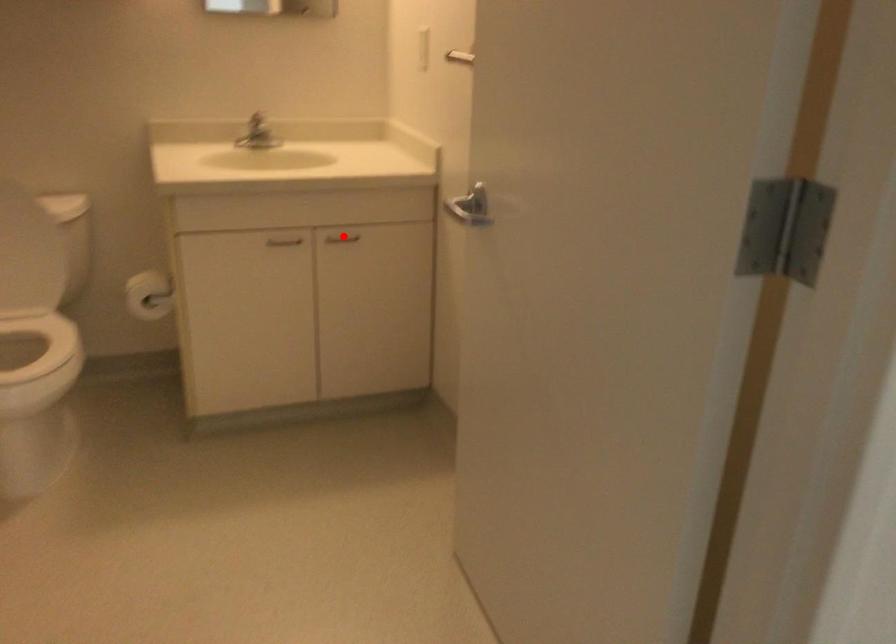
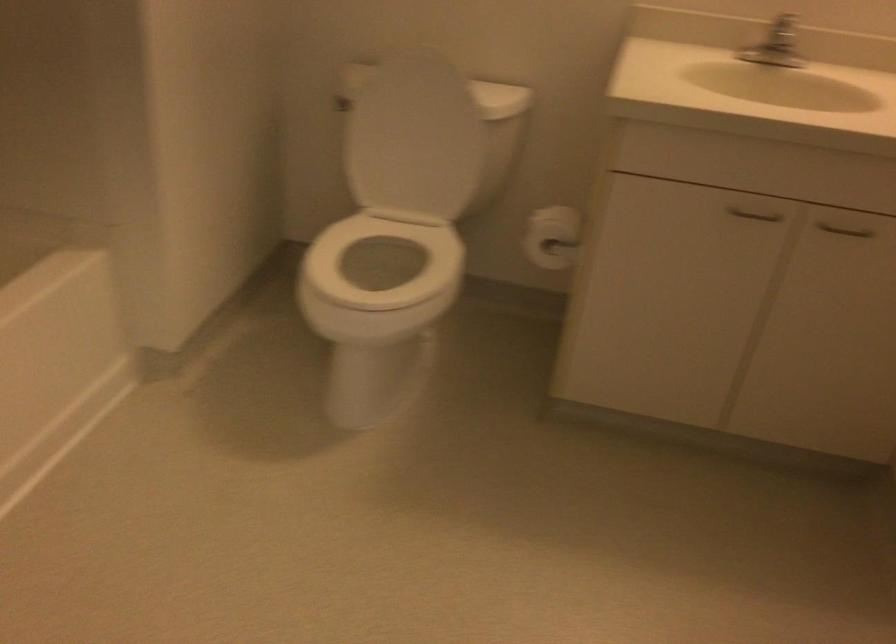
Question: I am providing you with two images of the same scene from different viewpoints. Image1 has a red point marked. In image2, the corresponding 3D location appears at what relative position? Reply with the corresponding letter.

Choices:
 (A) Closer
 (B) Farther

Answer: (A)